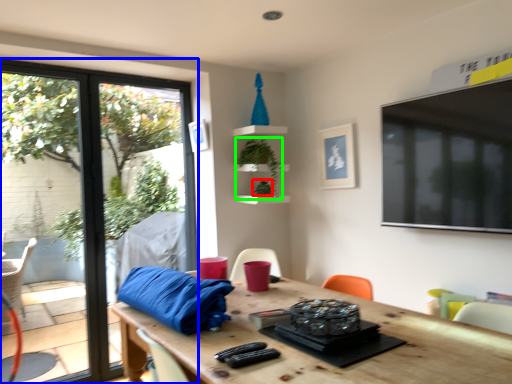
Question: Which object is positioned closest to plant (highlighted by a red box)? Select from window (highlighted by a blue box) and plant (highlighted by a green box).

Choices:
 (A) window
 (B) plant

Answer: (B)